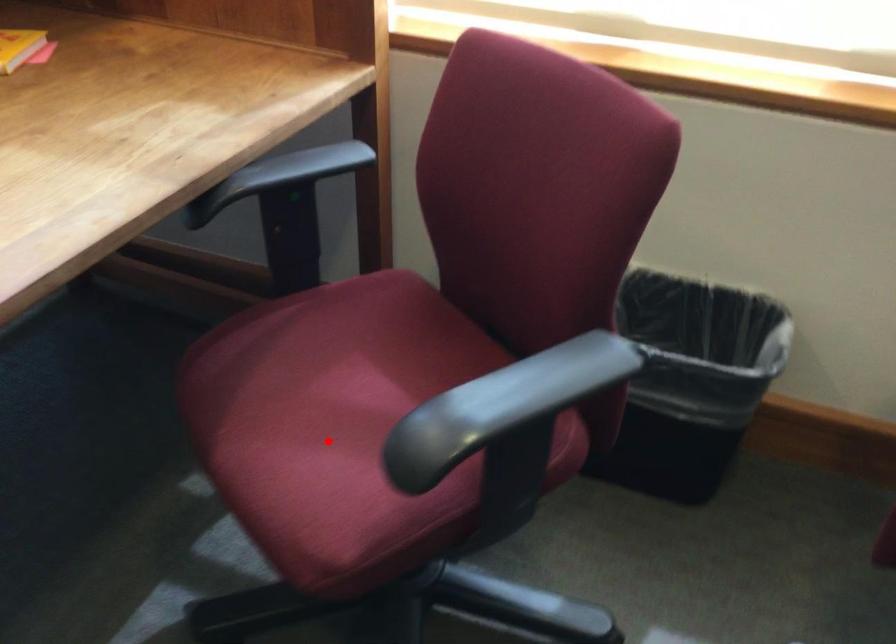
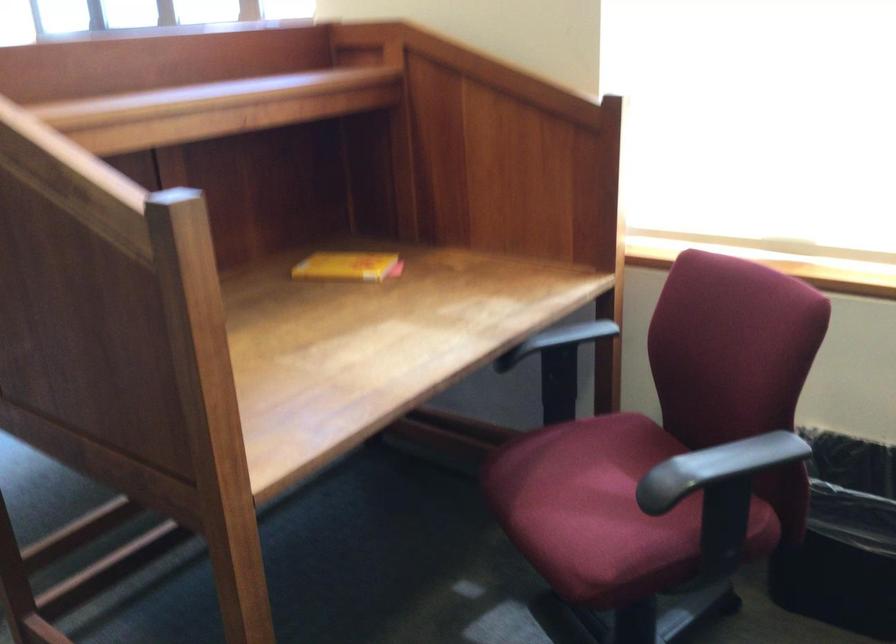
Find the pixel in the second image that matches the highlighted location in the first image.

(592, 509)